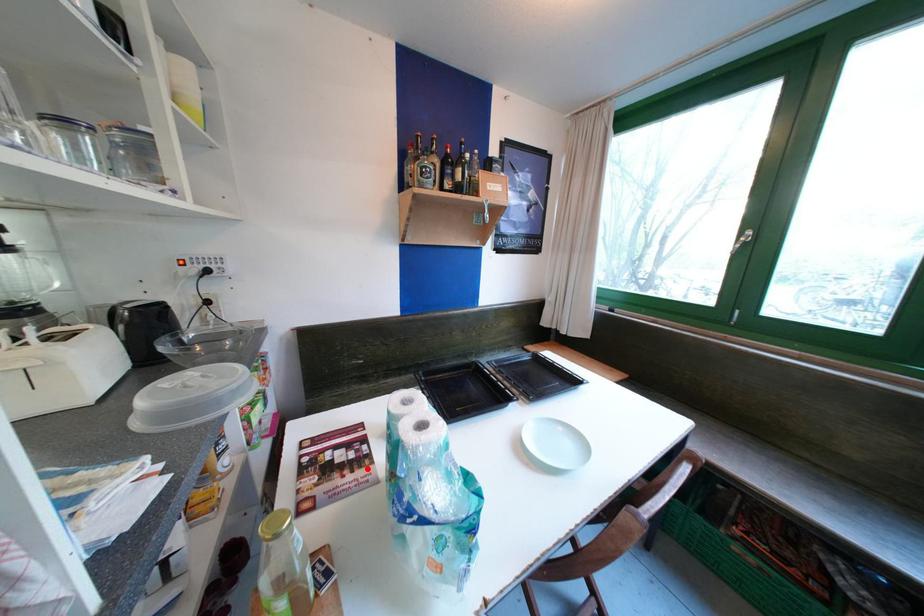
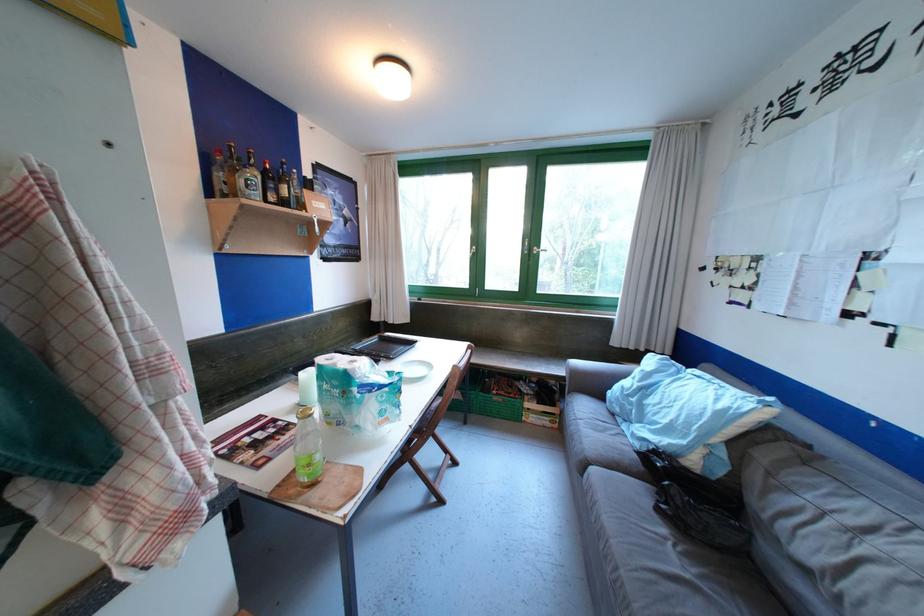
Locate, in the second image, the point that corresponds to the highlighted location in the first image.

(296, 432)